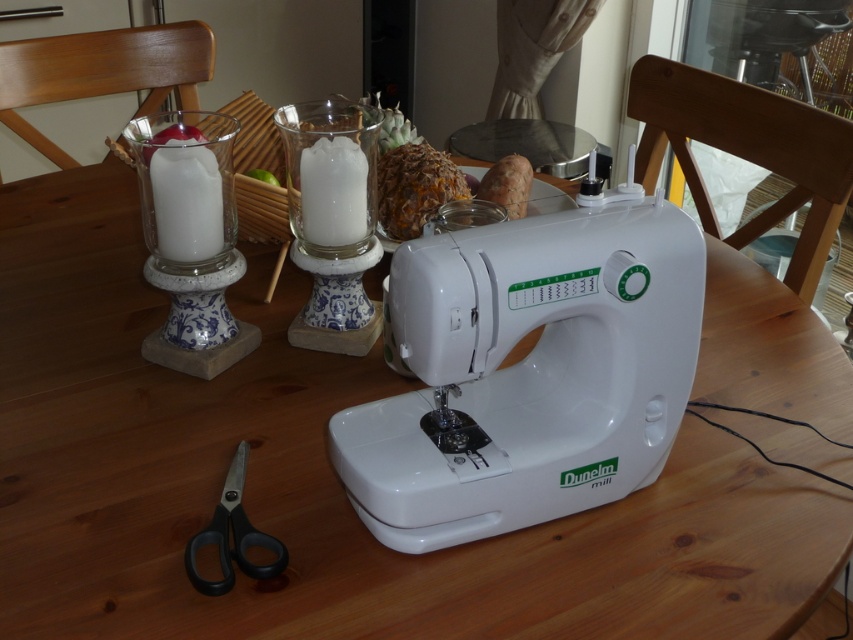
Based on the scene description, what are the coordinates of the white plastic sewing machine at center?

The white plastic sewing machine at center is located at coordinates (527, 371).

You are organizing items on a table and need to place a tall decorative item. Which of the two candle holders, the white ceramic candle holder at left or the white glass candle holder at center, should you choose?

The white ceramic candle holder at left is much taller than the white glass candle holder at center, so you should choose the white ceramic candle holder at left for the tall decorative item.

You are organizing items on a table and need to place a new item between the white glass candle holder at center and the black plastic scissors at lower left. Based on their positions, where should you place the new item?

The white glass candle holder at center is above the black plastic scissors at lower left, so you should place the new item in between them by positioning it below the candle holder and above the scissors.